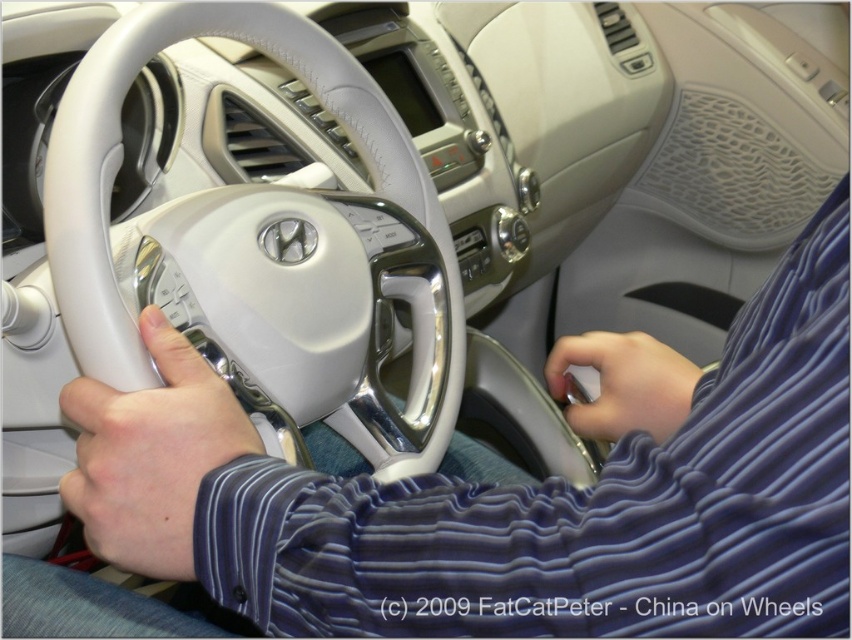
You are sitting in the driver seat of the car and want to adjust the air vents. You notice a white leather shirt at center and a satin blue sleeve at lower right. Which object is closer to you when reaching for the vents?

The white leather shirt at center is closer to the viewer than the satin blue sleeve at lower right, so you would reach the white leather shirt at center first when adjusting the air vents.

You are sitting in the driver seat of the car and want to reach the white leather shirt at center. Which direction should you move your hand to grab it?

The white leather shirt at center is located at point 0.783 on the x axis and 0.599 on the y axis. Since the shirt is at the center, you should move your hand forward from the steering wheel towards the dashboard to reach it.

You are a passenger in the car and want to reach the white leather shirt at center from your seat. The distance between you and the steering wheel is 12 inches. Can you grab it without moving your seat?

The distance between you and the steering wheel is 12 inches, and the white leather shirt at center is 9.79 inches away from you. Since 9.79 inches is less than 12 inches, you can reach the white leather shirt at center without moving your seat.